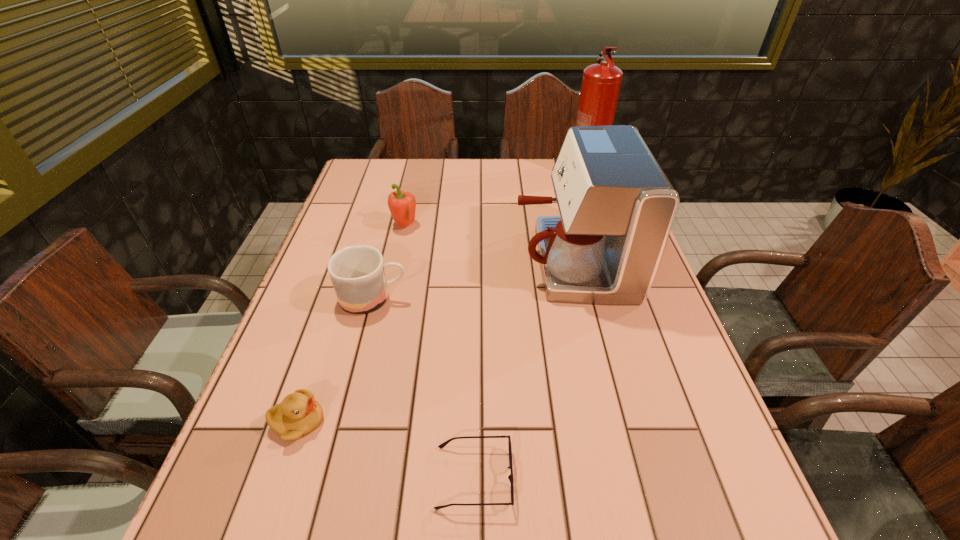
Where is `the tallest object`? Image resolution: width=960 pixels, height=540 pixels. the tallest object is located at coordinates (601, 82).

Where is `fire extinguisher`? This screenshot has width=960, height=540. fire extinguisher is located at coordinates (601, 82).

Image resolution: width=960 pixels, height=540 pixels. I want to click on the second tallest object, so click(x=617, y=207).

You are a GUI agent. You are given a task and a screenshot of the screen. Output one action in this format:
    pyautogui.click(x=<x>, y=<y>)
    Task: Click on the pepper
    This screenshot has width=960, height=540.
    Given the screenshot: What is the action you would take?
    pyautogui.click(x=402, y=205)

Locate an element on the screen. The width and height of the screenshot is (960, 540). mug is located at coordinates (357, 273).

Where is `the fifth tallest object`? The image size is (960, 540). the fifth tallest object is located at coordinates (299, 414).

Locate an element on the screen. The height and width of the screenshot is (540, 960). spectacles is located at coordinates (510, 477).

Find the location of a particular element. the third object from right to left is located at coordinates (510, 477).

You are a GUI agent. You are given a task and a screenshot of the screen. Output one action in this format:
    pyautogui.click(x=<x>, y=<y>)
    Task: Click on the free space located 0.200m on the handle side the fire extinguisher
    This screenshot has height=540, width=960.
    Given the screenshot: What is the action you would take?
    pyautogui.click(x=602, y=220)

Where is `vacant space located on the front of the coffee maker near the spout`? This screenshot has width=960, height=540. vacant space located on the front of the coffee maker near the spout is located at coordinates (425, 261).